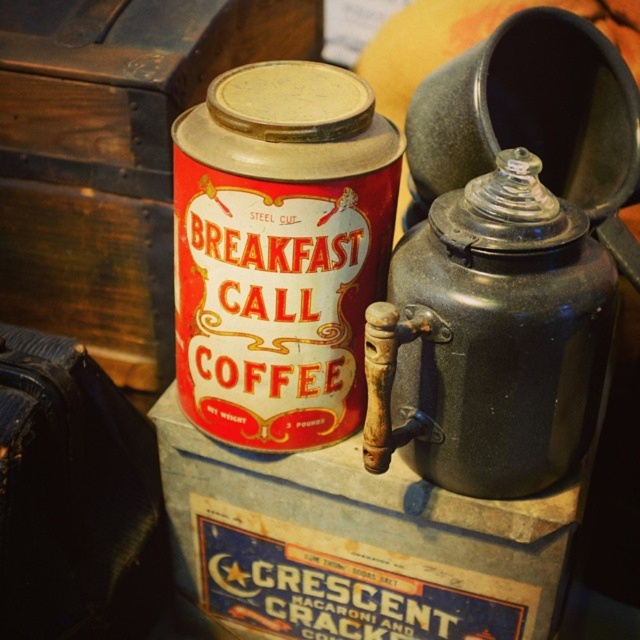
Question: Which object appears closest to the camera in this image?

Choices:
 (A) matte black teapot at center right
 (B) red matte tin can at center

Answer: (A)

Question: Is red matte tin can at center to the right of matte black teapot at center right from the viewer's perspective?

Choices:
 (A) yes
 (B) no

Answer: (B)

Question: Which point is farther to the camera?

Choices:
 (A) red matte tin can at center
 (B) matte black teapot at center right

Answer: (A)

Question: Is red matte tin can at center wider than matte black teapot at center right?

Choices:
 (A) no
 (B) yes

Answer: (B)

Question: Which object appears farthest from the camera in this image?

Choices:
 (A) red matte tin can at center
 (B) matte black teapot at center right

Answer: (A)

Question: Does red matte tin can at center have a lesser width compared to matte black teapot at center right?

Choices:
 (A) yes
 (B) no

Answer: (B)